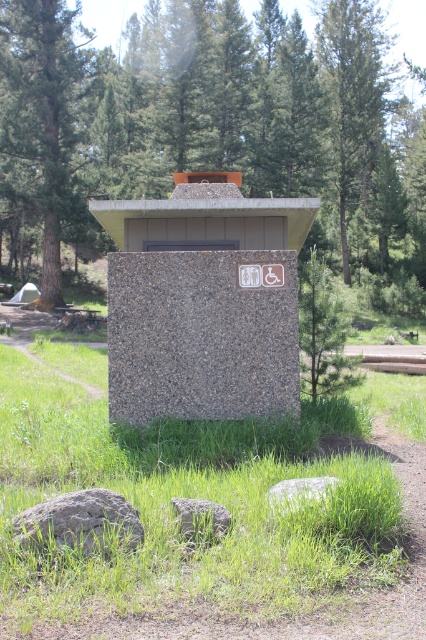
Who is higher up, green grass at center or gray rough rock at lower left?

green grass at center

Who is lower down, green grass at center or gray rough rock at lower left?

gray rough rock at lower left

Between point (324, 557) and point (91, 500), which one is positioned in front?

Point (324, 557) is in front.

Where is `green grass at center`? This screenshot has width=426, height=640. green grass at center is located at coordinates (195, 538).

In the scene shown: How distant is granite at center from green textured tree at upper left?

granite at center is 31.51 meters from green textured tree at upper left.

Does granite at center appear under green textured tree at upper left?

Yes, granite at center is below green textured tree at upper left.

The height and width of the screenshot is (640, 426). Describe the element at coordinates (201, 336) in the screenshot. I see `granite at center` at that location.

Find the location of a particular element. This screenshot has width=426, height=640. granite at center is located at coordinates (201, 336).

Does green textured tree at upper left appear under gray granite rock at lower center?

No.

Does green textured tree at upper left appear over gray granite rock at lower center?

Indeed, green textured tree at upper left is positioned over gray granite rock at lower center.

Who is more distant from viewer, [5,115] or [273,502]?

The point [5,115] is behind.

At what (x,y) coordinates should I click in order to perform the action: click on green textured tree at upper left. Please return your answer as a coordinate pair (x, y). The image size is (426, 640). Looking at the image, I should click on (42, 120).